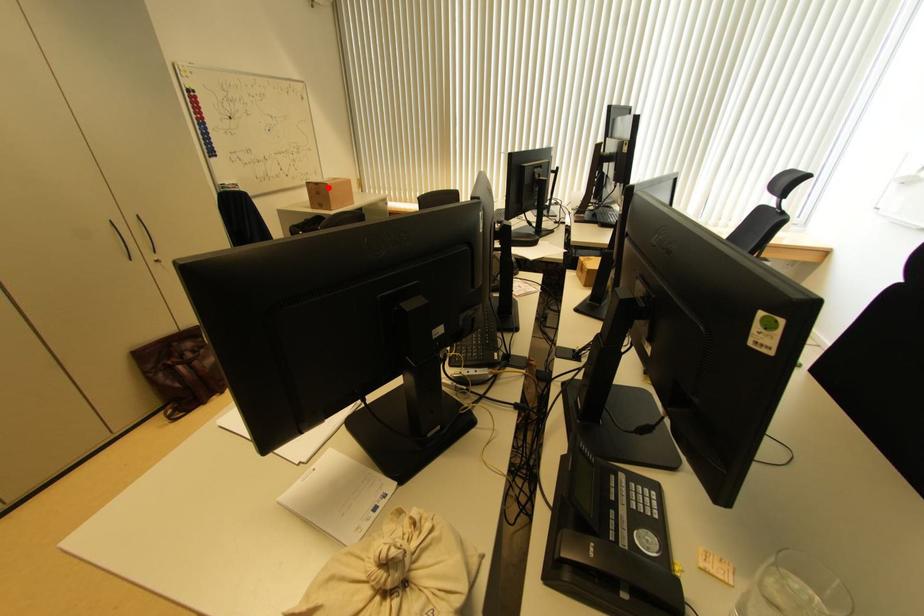
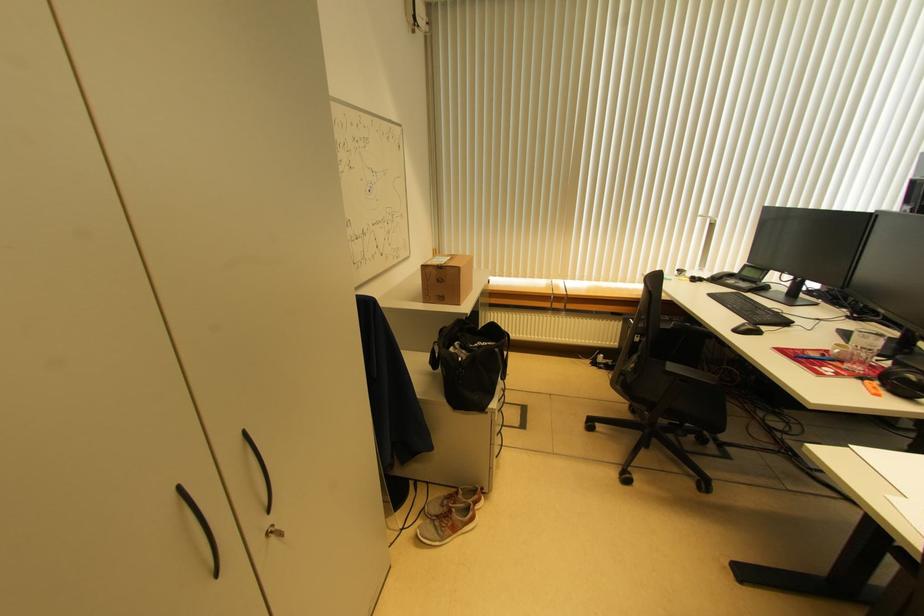
Locate, in the second image, the point that corresponds to the highlighted location in the first image.

(459, 272)